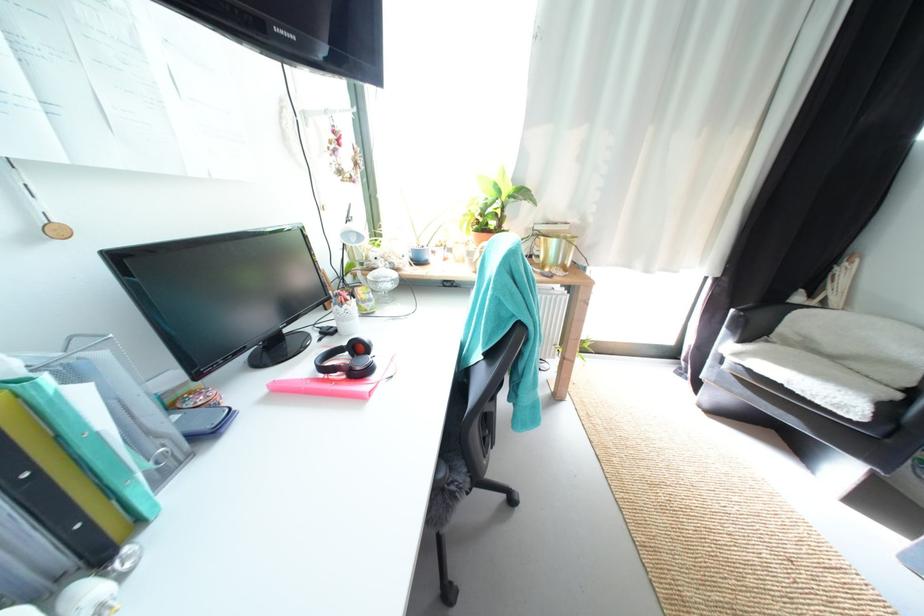
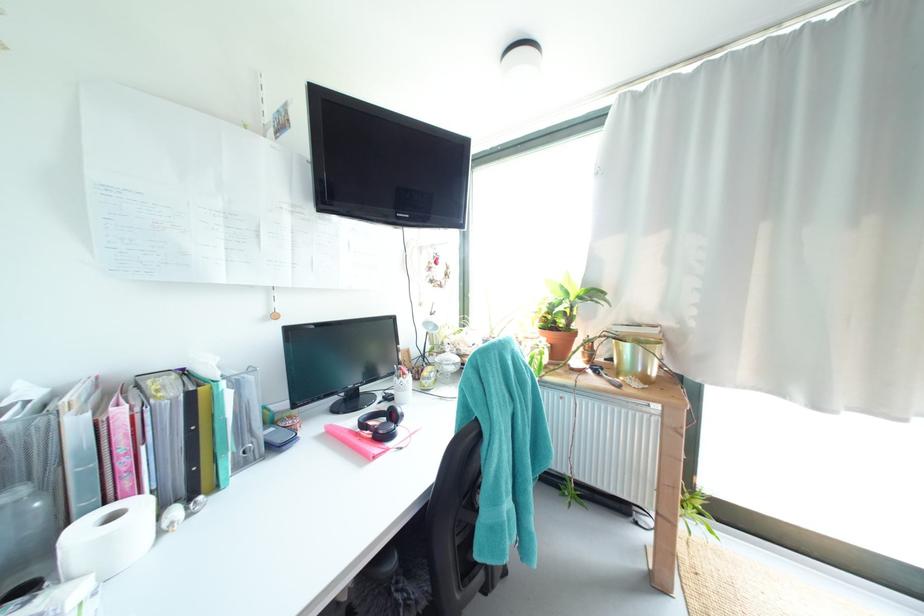
Locate, in the second image, the point that corresponds to pixel 367 370 in the first image.

(388, 434)